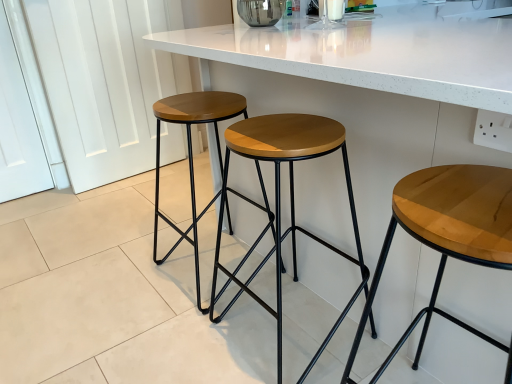
Identify the location of vacant point above light brown wood stool at center, positioned as the third stool in left-to-right order (from a real-world perspective). This screenshot has height=384, width=512. (460, 199).